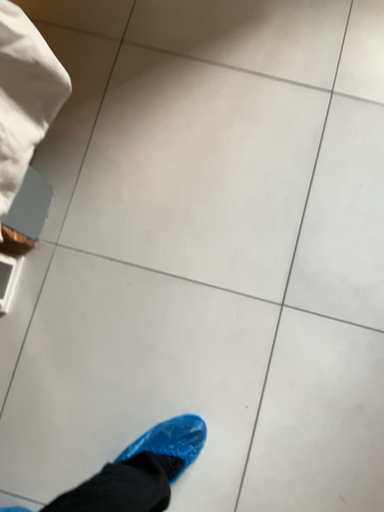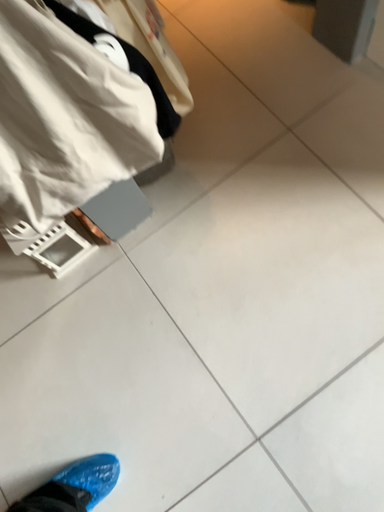
Question: How did the camera likely rotate when shooting the video?

Choices:
 (A) rotated right
 (B) rotated left

Answer: (B)